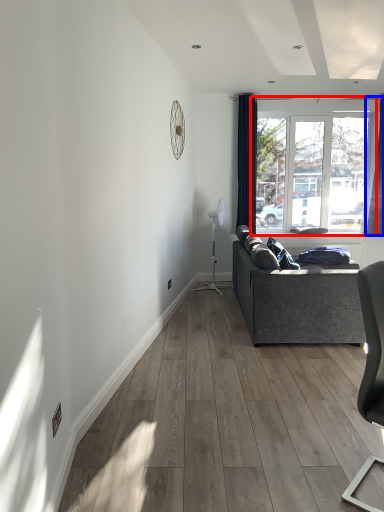
Question: Which object appears farthest to the camera in this image, window (highlighted by a red box) or curtain (highlighted by a blue box)?

Choices:
 (A) window
 (B) curtain

Answer: (A)